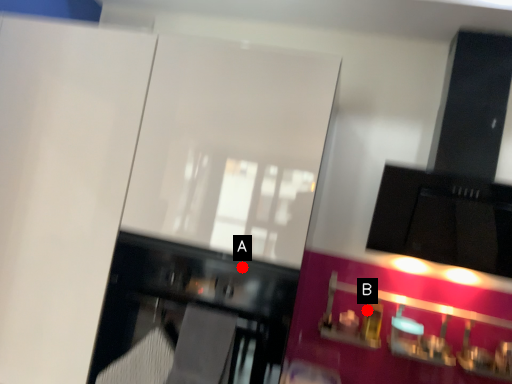
Question: Two points are circled on the image, labeled by A and B beside each circle. Which point is farther to the camera?

Choices:
 (A) A is further
 (B) B is further

Answer: (B)